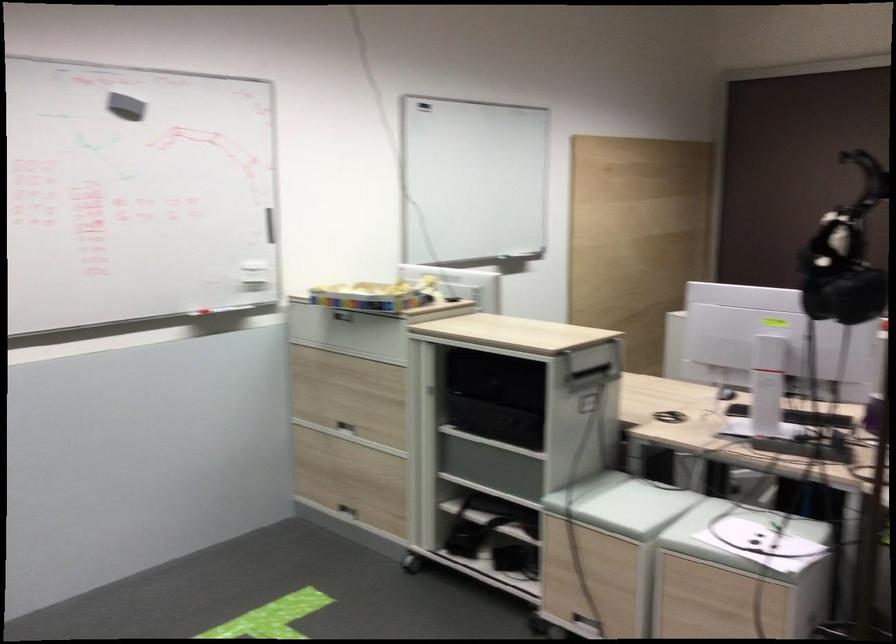
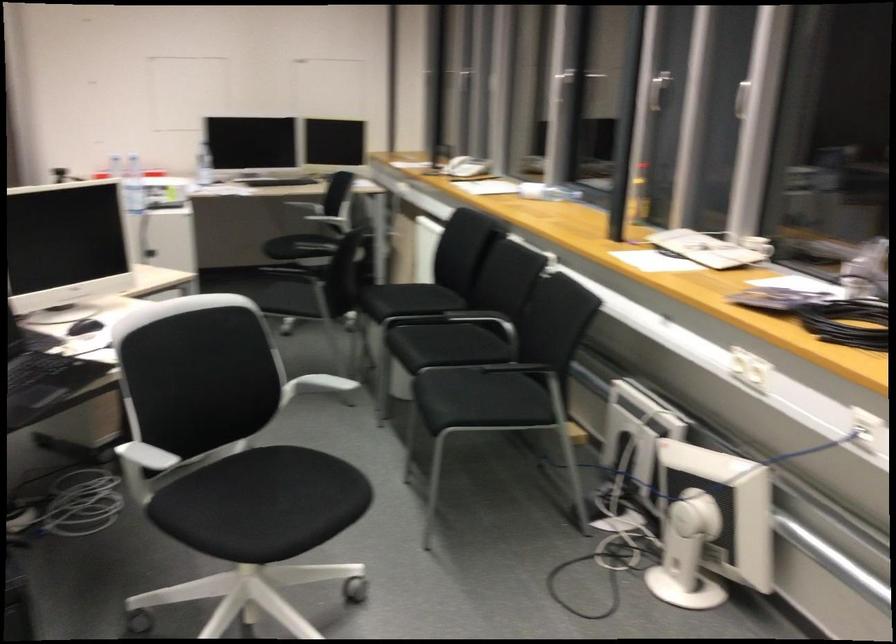
Question: How did the camera likely rotate?

Choices:
 (A) Left
 (B) Right
 (C) Up
 (D) Down

Answer: (B)